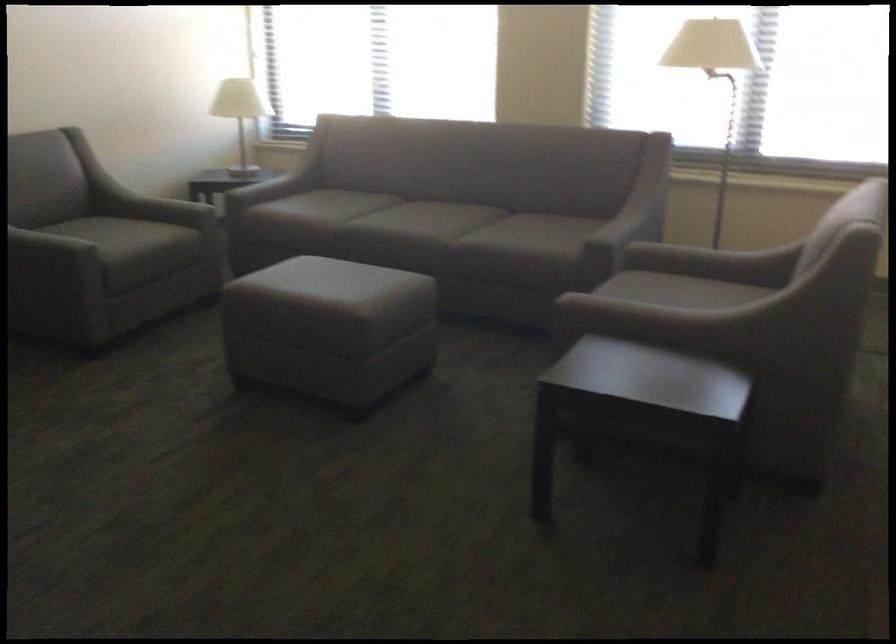
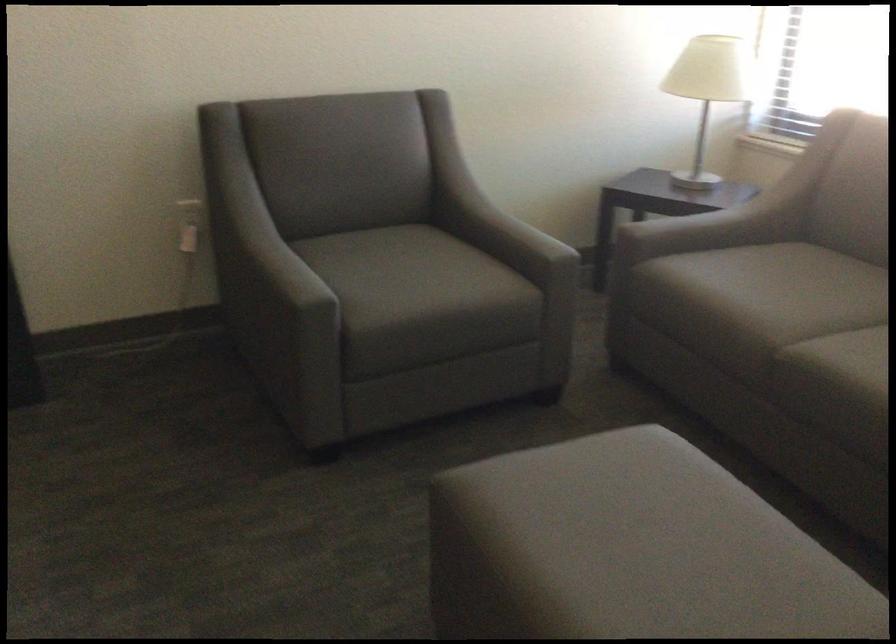
Where in the second image is the point corresponding to (x=113, y=229) from the first image?

(411, 263)